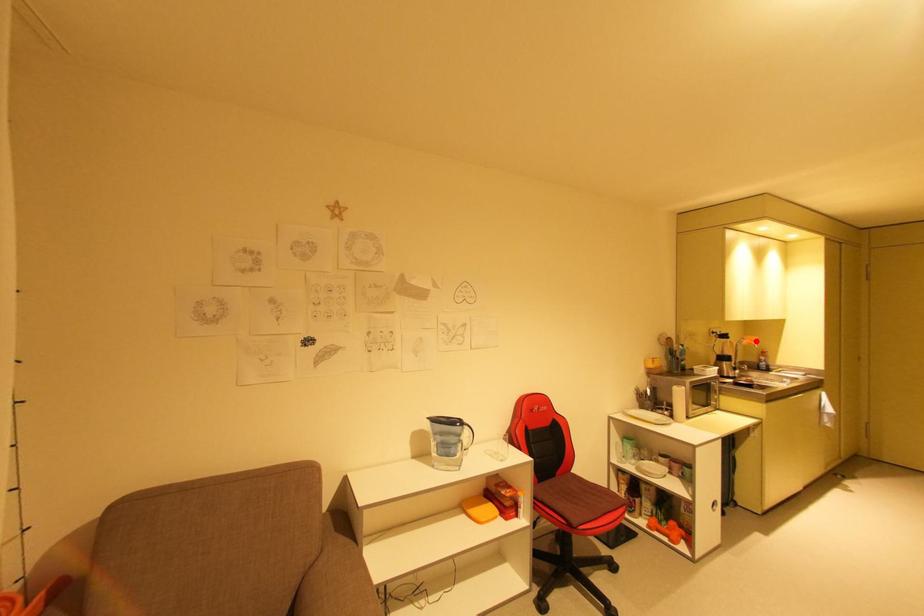
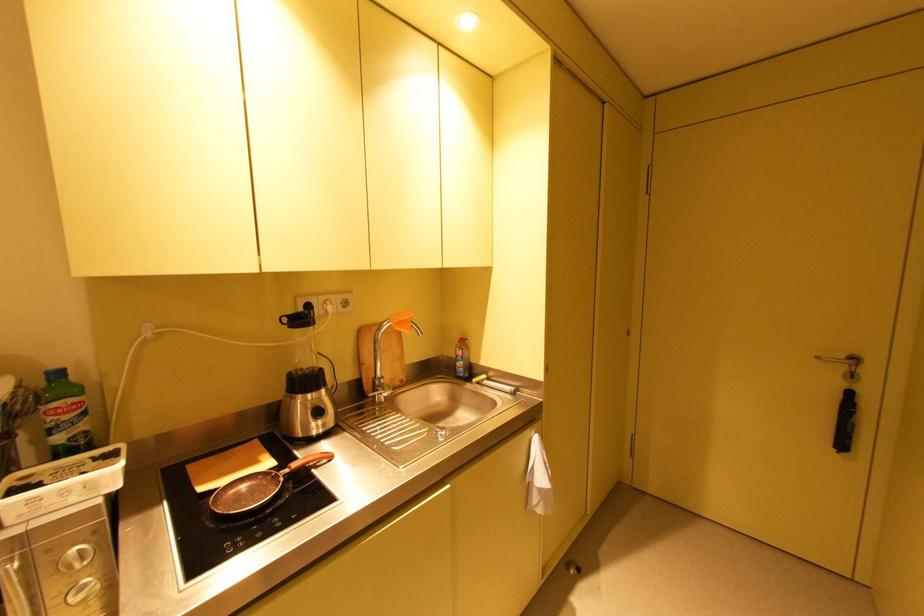
Where in the second image is the point corresponding to the highlighted location from the first image?

(400, 325)